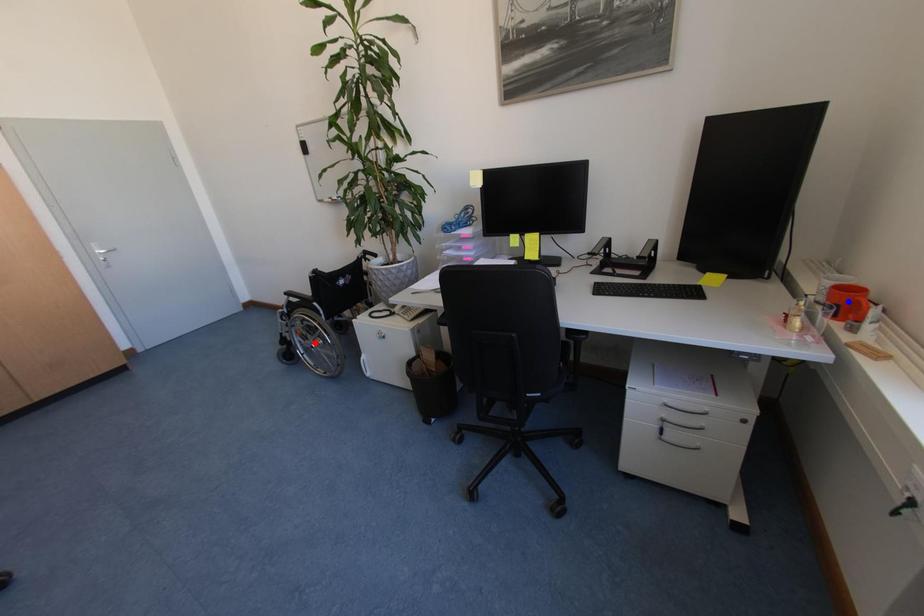
Question: In the image, two points are highlighted. Which point is nearer to the camera? Reply with the corresponding letter.

Choices:
 (A) blue point
 (B) red point

Answer: (A)